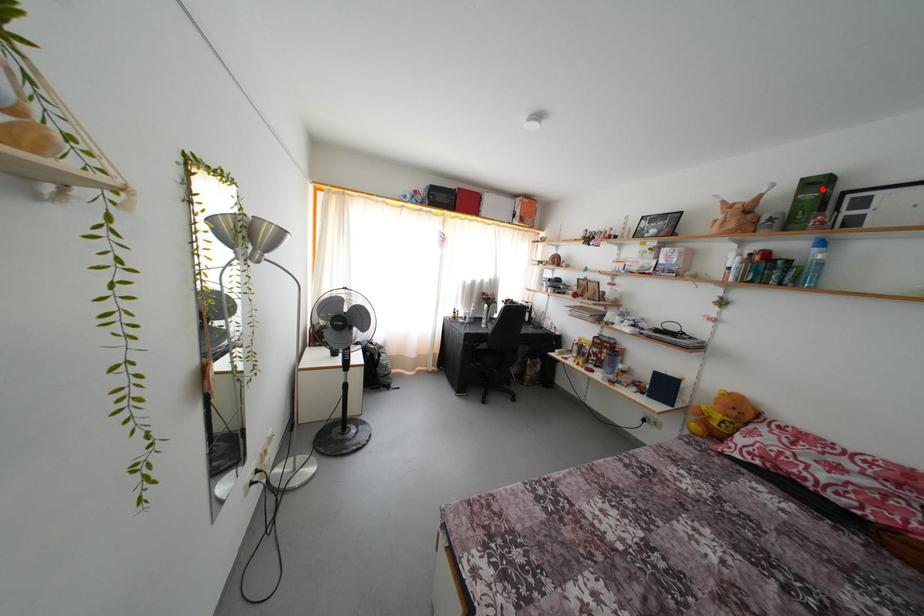
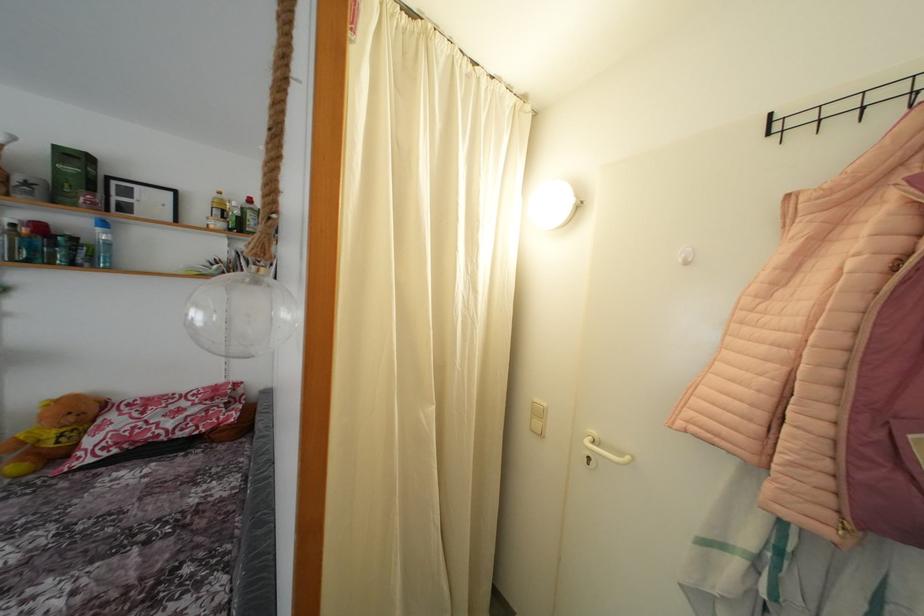
Question: I am providing you with two images of the same scene from different viewpoints. In image1, a red point is highlighted. Considering the same 3D point in image2, which of the following is correct?

Choices:
 (A) It is closer
 (B) It is farther

Answer: (B)